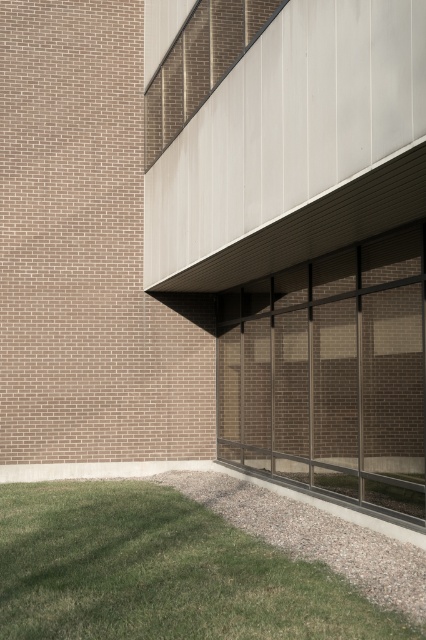
Question: Does clear glass windows at center appear on the left side of green grass at lower left?

Choices:
 (A) yes
 (B) no

Answer: (B)

Question: From the image, what is the correct spatial relationship of clear glass windows at center in relation to green grass at lower left?

Choices:
 (A) right
 (B) left

Answer: (A)

Question: Which object appears farthest from the camera in this image?

Choices:
 (A) green grass at lower left
 (B) clear glass windows at center

Answer: (B)

Question: Is the position of clear glass windows at center more distant than that of green grass at lower left?

Choices:
 (A) yes
 (B) no

Answer: (A)

Question: Which of the following is the farthest from the observer?

Choices:
 (A) green grass at lower left
 (B) clear glass windows at center

Answer: (B)